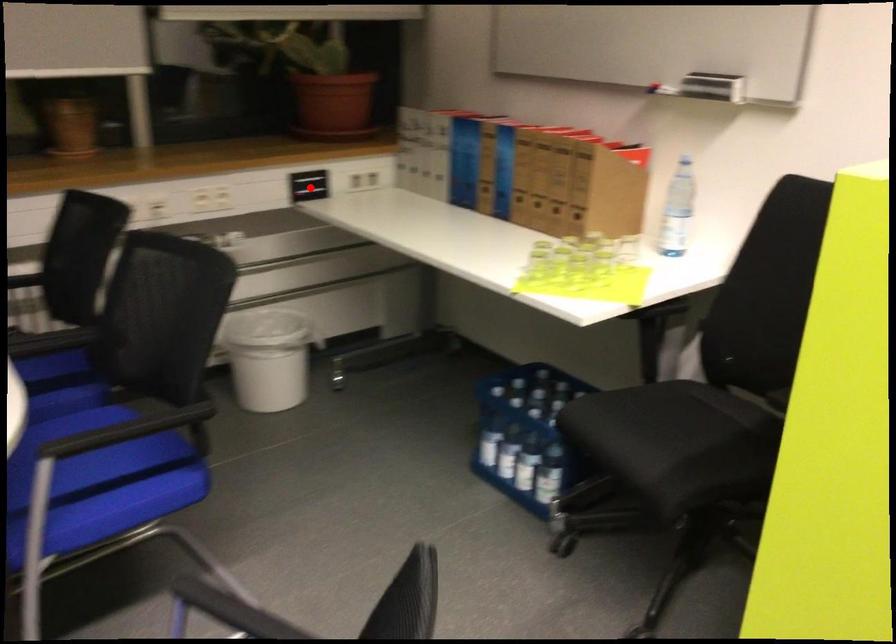
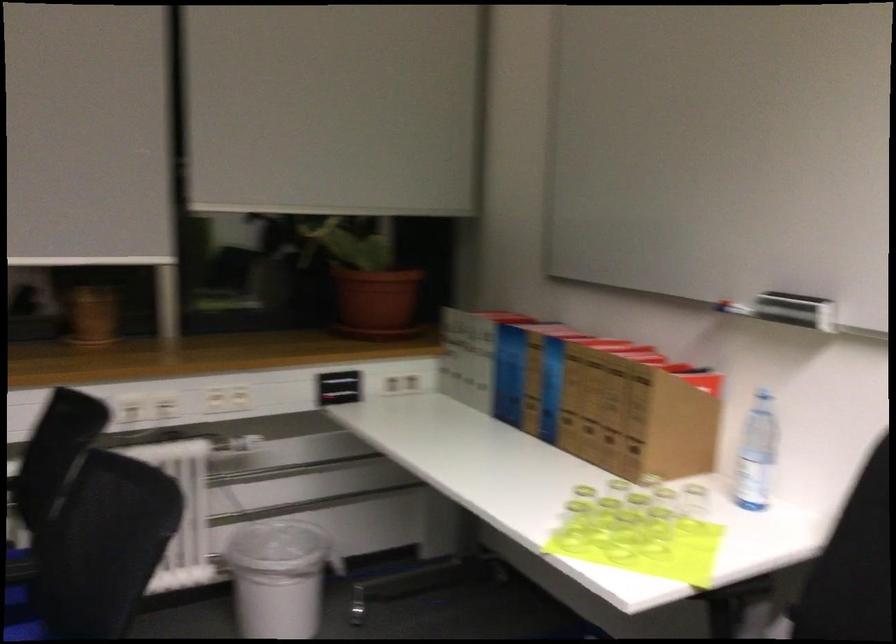
Find the pixel in the second image that matches the highlighted location in the first image.

(339, 386)